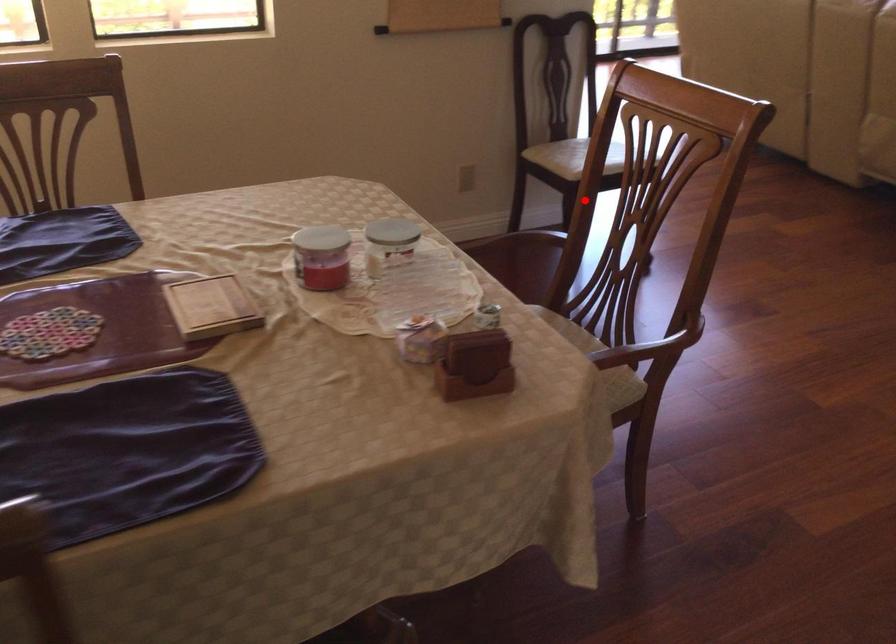
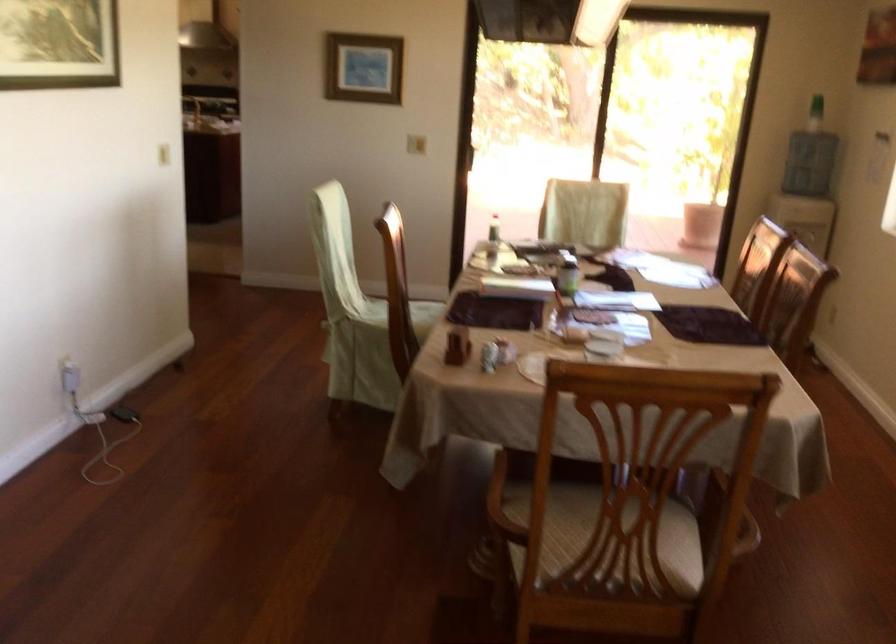
Question: I am providing you with two images of the same scene from different viewpoints. A red point is shown in image1. For the corresponding object point in image2, is it positioned nearer or farther from the camera?

Choices:
 (A) Nearer
 (B) Farther

Answer: (A)